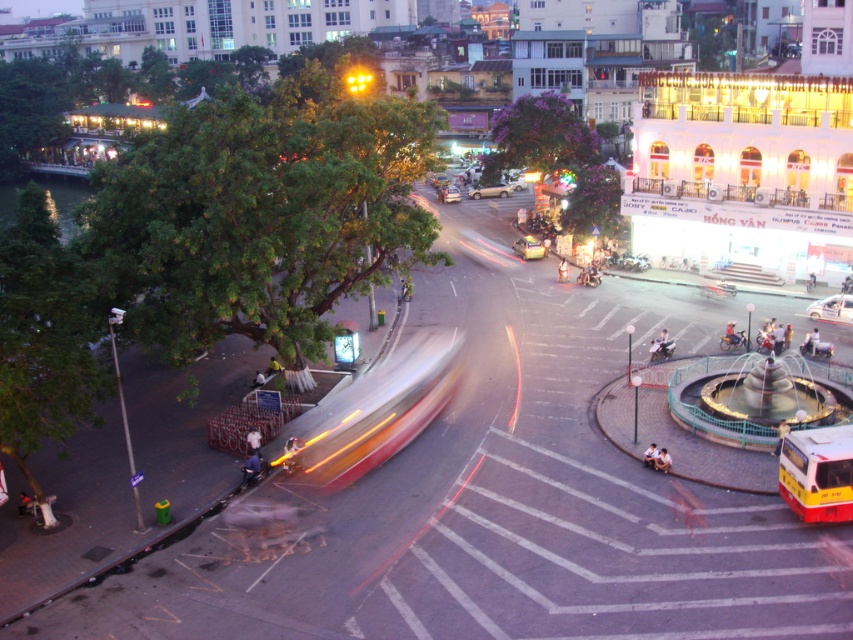
Can you confirm if metallic silver car at center is positioned above yellow metallic car at center?

No.

From the picture: Is metallic silver car at center to the right of yellow metallic car at center from the viewer's perspective?

Yes, metallic silver car at center is to the right of yellow metallic car at center.

Find the location of `metallic silver car at center`. metallic silver car at center is located at coordinates (833, 308).

Is point (791, 440) behind point (451, 186)?

No, it is not.

Between point (828, 506) and point (450, 193), which one is positioned behind?

Positioned behind is point (450, 193).

Image resolution: width=853 pixels, height=640 pixels. I want to click on yellow matte bus at lower right, so click(x=817, y=474).

Where is `yellow matte bus at lower right`? This screenshot has height=640, width=853. yellow matte bus at lower right is located at coordinates (817, 474).

Does yellow matte bus at lower right have a greater height compared to gold metallic sedan at center?

Yes.

Does yellow matte bus at lower right appear on the right side of gold metallic sedan at center?

Yes, yellow matte bus at lower right is to the right of gold metallic sedan at center.

Find the location of `yellow matte bus at lower right`. yellow matte bus at lower right is located at coordinates (817, 474).